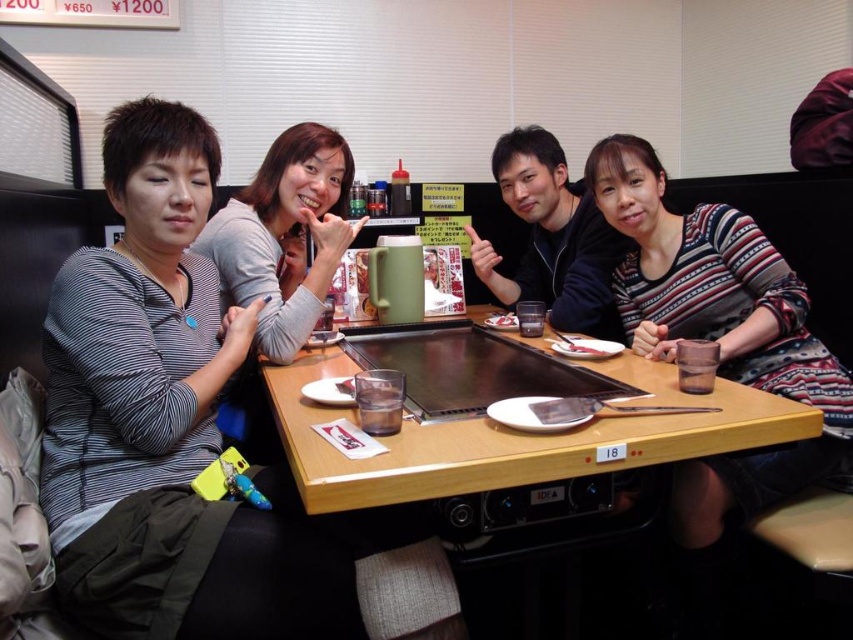
You are a photographer standing at the entrance of the restaurant. You want to take a photo of the white glossy rice at center so that it is centered in the frame. Where should you position yourself relative to the table?

You should position yourself directly in front of the table at a point aligned with the coordinates where the white glossy rice at center is located, which is at point (502,321). This will ensure the rice is centered in your photo.

You are standing in the dining area and want to place a new decorative item on the wooden table at center. According to the image, where should you place it to ensure it stays on the table?

The wooden table at center is located at the 2D coordinates point [514,436], so placing the decorative item there would ensure it stays on the table.